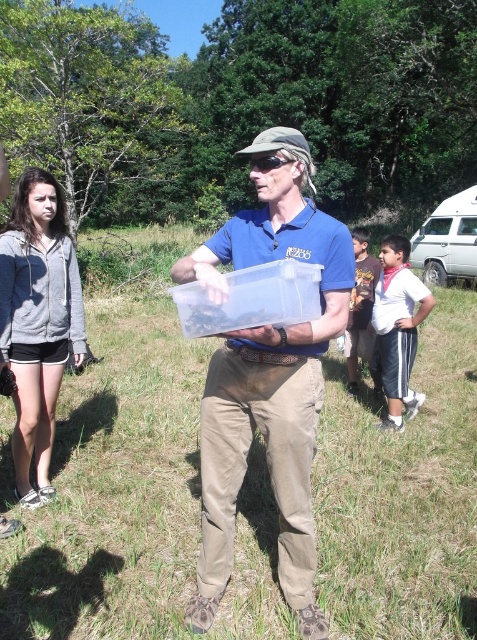
Question: Estimate the real-world distances between objects in this image. Which object is closer to the green grass at center?

Choices:
 (A) white cotton shirt at center
 (B) gray hoodie at left
 (C) white cotton shirt at right

Answer: (B)

Question: Does matte plastic container at center appear under white cotton shirt at center?

Choices:
 (A) no
 (B) yes

Answer: (B)

Question: Can you confirm if green grass at center is positioned below matte plastic container at center?

Choices:
 (A) yes
 (B) no

Answer: (A)

Question: Is gray hoodie at left above white cotton shirt at right?

Choices:
 (A) no
 (B) yes

Answer: (A)

Question: Which point is closer to the camera?

Choices:
 (A) white cotton shirt at right
 (B) white cotton shirt at center
 (C) gray hoodie at left
 (D) green grass at center

Answer: (D)

Question: Which object is positioned farthest from the white cotton shirt at right?

Choices:
 (A) gray hoodie at left
 (B) green grass at center
 (C) white cotton shirt at center

Answer: (A)